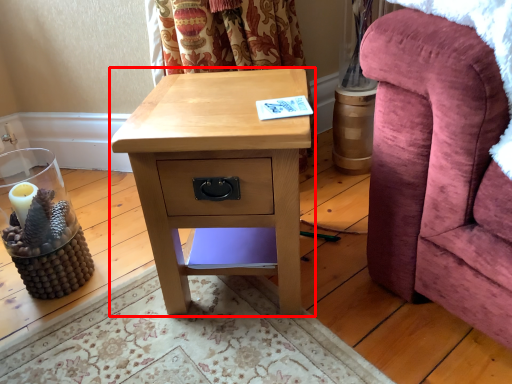
Question: From the image's perspective, where is nightstand (annotated by the red box) located relative to furniture?

Choices:
 (A) below
 (B) above

Answer: (A)